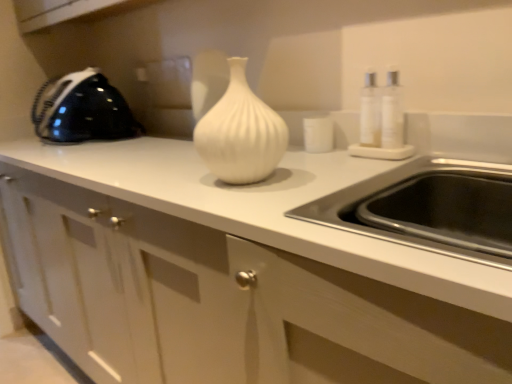
The width and height of the screenshot is (512, 384). Identify the location of white glossy vase at center. (241, 133).

Looking at this image, what is the approximate height of white glossy vase at center?

9.80 inches.

Describe the element at coordinates (214, 298) in the screenshot. I see `white glossy cabinet at center` at that location.

In order to click on white glossy vase at center in this screenshot , I will do `click(241, 133)`.

What are the coordinates of `vase below the black glossy iron at left (from the image's perspective)` in the screenshot? It's located at (241, 133).

Considering the relative sizes of black glossy iron at left and white glossy vase at center in the image provided, is black glossy iron at left shorter than white glossy vase at center?

Incorrect, the height of black glossy iron at left does not fall short of that of white glossy vase at center.

From the image's perspective, is black glossy iron at left located above or below white glossy vase at center?

From the image's perspective, black glossy iron at left appears above white glossy vase at center.

Between black glossy iron at left and white glossy vase at center, which one has smaller width?

white glossy vase at center is thinner.

Can you tell me how much white glossy cabinet at center and black glossy iron at left differ in facing direction?

6.94e-05 degrees.

Which object is closer to the camera, white glossy cabinet at center or black glossy iron at left?

Positioned in front is white glossy cabinet at center.

Which object is positioned more to the left, white glossy cabinet at center or black glossy iron at left?

black glossy iron at left.

Are white glossy cabinet at center and black glossy iron at left making contact?

No, white glossy cabinet at center is not making contact with black glossy iron at left.

Can you see white glossy vase at center touching black glossy iron at left?

No.

Considering the relative positions of white glossy vase at center and black glossy iron at left in the image provided, is white glossy vase at center to the left of black glossy iron at left from the viewer's perspective?

In fact, white glossy vase at center is to the right of black glossy iron at left.

Which is more distant, (230, 178) or (78, 109)?

The point (78, 109) is behind.

You are a GUI agent. You are given a task and a screenshot of the screen. Output one action in this format:
    pyautogui.click(x=<x>, y=<y>)
    Task: Click on the vase that is on the right side of black glossy iron at left
    Image resolution: width=512 pixels, height=384 pixels.
    Given the screenshot: What is the action you would take?
    pyautogui.click(x=241, y=133)

Is white glossy vase at center inside white glossy cabinet at center?

Definitely not — white glossy vase at center is not inside white glossy cabinet at center.

Considering the sizes of objects white glossy cabinet at center and white glossy vase at center in the image provided, who is taller, white glossy cabinet at center or white glossy vase at center?

With more height is white glossy cabinet at center.

From the image's perspective, which is above, white glossy cabinet at center or white glossy vase at center?

From the image's view, white glossy vase at center is above.

Where is `cabinetry below the white glossy vase at center (from a real-world perspective)`? Image resolution: width=512 pixels, height=384 pixels. cabinetry below the white glossy vase at center (from a real-world perspective) is located at coordinates (214, 298).

Is black glossy iron at left further to the viewer compared to white glossy cabinet at center?

That is True.

Between black glossy iron at left and white glossy cabinet at center, which one has less height?

Standing shorter between the two is black glossy iron at left.

From a real-world perspective, between black glossy iron at left and white glossy cabinet at center, who is vertically higher?

In real-world perspective, black glossy iron at left is above.

Considering the relative sizes of black glossy iron at left and white glossy cabinet at center in the image provided, is black glossy iron at left bigger than white glossy cabinet at center?

Actually, black glossy iron at left might be smaller than white glossy cabinet at center.

Is white glossy cabinet at center at the back of white glossy vase at center?

white glossy vase at center does not have its back to white glossy cabinet at center.

From a real-world perspective, between white glossy vase at center and white glossy cabinet at center, who is vertically higher?

white glossy vase at center.

Is white glossy vase at center wider or thinner than white glossy cabinet at center?

Considering their sizes, white glossy vase at center looks slimmer than white glossy cabinet at center.

Which object is positioned more to the right, white glossy vase at center or white glossy cabinet at center?

white glossy vase at center is more to the right.

In the image, there is a white glossy vase at center. Where is `appliance above it (from the image's perspective)`? This screenshot has height=384, width=512. appliance above it (from the image's perspective) is located at coordinates (82, 110).

At what (x,y) coordinates should I click in order to perform the action: click on cabinetry that appears below the black glossy iron at left (from a real-world perspective). Please return your answer as a coordinate pair (x, y). Image resolution: width=512 pixels, height=384 pixels. Looking at the image, I should click on (214, 298).

Based on their spatial positions, is white glossy vase at center or white glossy cabinet at center further from black glossy iron at left?

white glossy vase at center lies further to black glossy iron at left than the other object.

Based on their spatial positions, is white glossy cabinet at center or white glossy vase at center further from black glossy iron at left?

white glossy vase at center lies further to black glossy iron at left than the other object.

Considering their positions, is white glossy vase at center positioned further to white glossy cabinet at center than black glossy iron at left?

The object further to white glossy cabinet at center is black glossy iron at left.

Which object lies further to the anchor point white glossy vase at center, white glossy cabinet at center or black glossy iron at left?

black glossy iron at left is further to white glossy vase at center.

Considering their positions, is black glossy iron at left positioned closer to white glossy vase at center than white glossy cabinet at center?

white glossy cabinet at center lies closer to white glossy vase at center than the other object.

From the image, which object appears to be farther from white glossy cabinet at center, black glossy iron at left or white glossy vase at center?

black glossy iron at left lies further to white glossy cabinet at center than the other object.

I want to click on vase located between white glossy cabinet at center and black glossy iron at left in the depth direction, so click(241, 133).